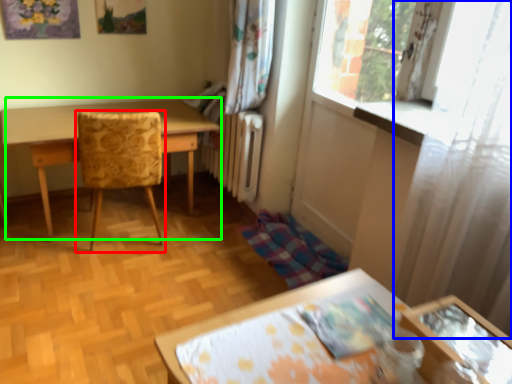
Question: Estimate the real-world distances between objects in this image. Which object is closer to chair (highlighted by a red box), curtain (highlighted by a blue box) or table (highlighted by a green box)?

Choices:
 (A) curtain
 (B) table

Answer: (B)